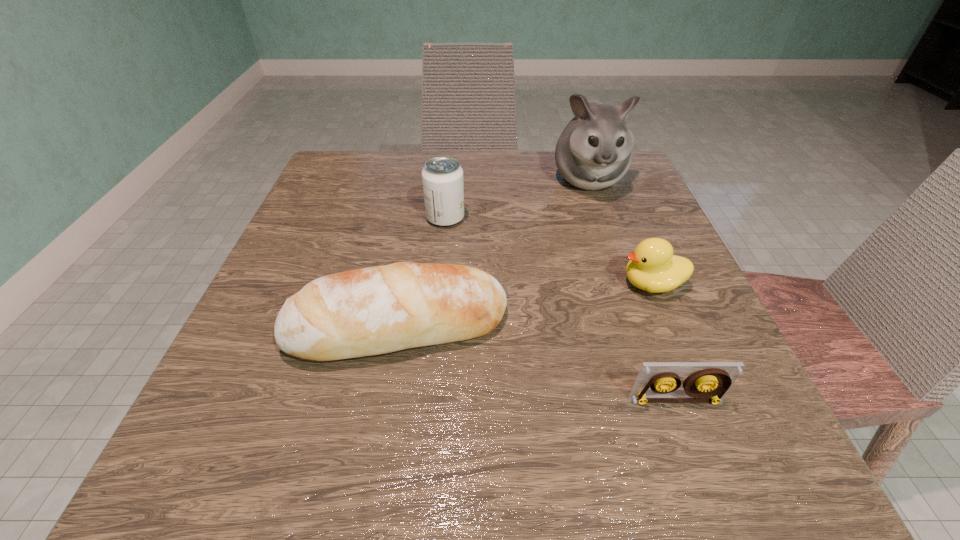
Where is `free space located 0.110m on the beak of the duckling`? free space located 0.110m on the beak of the duckling is located at coordinates (555, 285).

The height and width of the screenshot is (540, 960). Find the location of `vacant space situated 0.350m on the beak of the duckling`. vacant space situated 0.350m on the beak of the duckling is located at coordinates (415, 285).

You are a GUI agent. You are given a task and a screenshot of the screen. Output one action in this format:
    pyautogui.click(x=<x>, y=<y>)
    Task: Click on the free location located on the beak of the duckling
    Image resolution: width=960 pixels, height=540 pixels.
    Given the screenshot: What is the action you would take?
    pyautogui.click(x=397, y=285)

Locate an element on the screen. This screenshot has height=540, width=960. object that is at the far edge is located at coordinates point(594,151).

Locate an element on the screen. This screenshot has width=960, height=540. object located in the left edge section of the desktop is located at coordinates point(376,310).

The width and height of the screenshot is (960, 540). I want to click on hamster that is at the right edge, so click(594, 151).

Where is `duckling that is at the right edge`? duckling that is at the right edge is located at coordinates (652, 267).

This screenshot has height=540, width=960. I want to click on videotape that is positioned at the right edge, so click(708, 382).

You are a GUI agent. You are given a task and a screenshot of the screen. Output one action in this format:
    pyautogui.click(x=<x>, y=<y>)
    Task: Click on the object situated at the far right corner
    The image size is (960, 540).
    Given the screenshot: What is the action you would take?
    pyautogui.click(x=594, y=151)

Where is `free location at the far edge of the desktop`? free location at the far edge of the desktop is located at coordinates (467, 160).